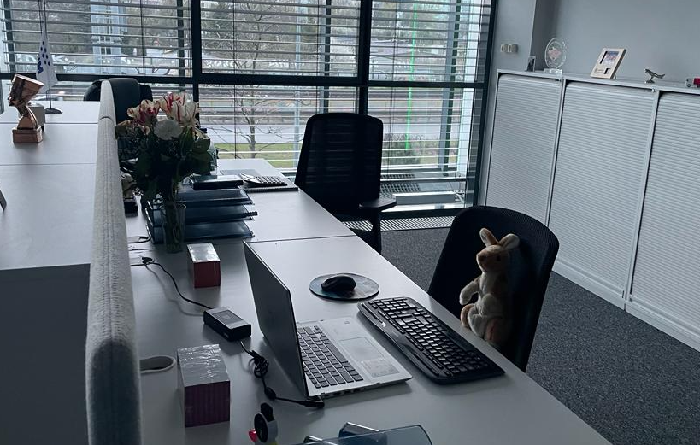
The image size is (700, 445). What are the coordinates of `1 vase` in the screenshot? It's located at (175, 222).